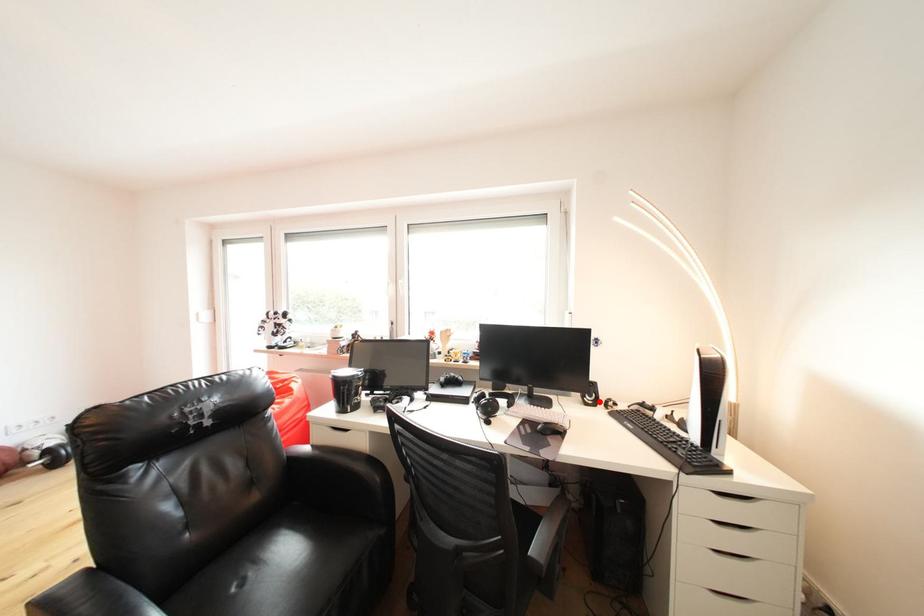
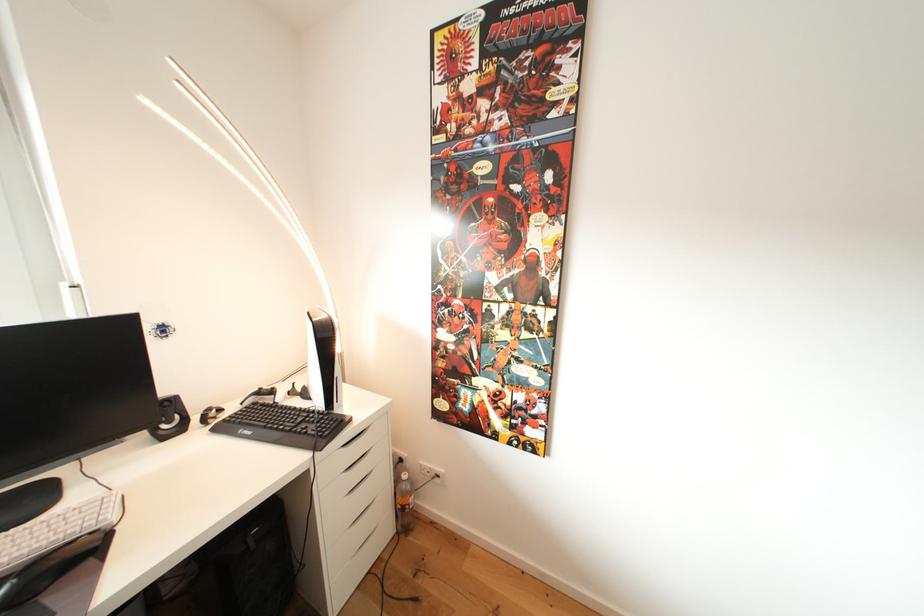
Find the pixel in the second image that matches the highlighted location in the first image.

(178, 427)